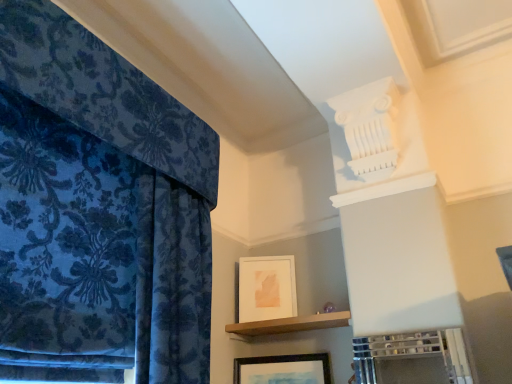
Question: Considering the relative sizes of velvet blue curtain at left and wooden framed picture at lower center, which is the 2th picture frame in back-to-front order, in the image provided, is velvet blue curtain at left taller than wooden framed picture at lower center, which is the 2th picture frame in back-to-front order,?

Choices:
 (A) no
 (B) yes

Answer: (B)

Question: Is velvet blue curtain at left bigger than wooden framed picture at lower center, positioned as the first picture frame in bottom-to-top order?

Choices:
 (A) no
 (B) yes

Answer: (B)

Question: Considering the relative positions of velvet blue curtain at left and wooden framed picture at lower center, the second picture frame in the top-to-bottom sequence, in the image provided, is velvet blue curtain at left to the right of wooden framed picture at lower center, the second picture frame in the top-to-bottom sequence, from the viewer's perspective?

Choices:
 (A) yes
 (B) no

Answer: (B)

Question: Is velvet blue curtain at left far away from wooden framed picture at lower center, positioned as the first picture frame in bottom-to-top order?

Choices:
 (A) yes
 (B) no

Answer: (B)

Question: Does velvet blue curtain at left touch wooden framed picture at lower center, which is counted as the first picture frame, starting from the front?

Choices:
 (A) yes
 (B) no

Answer: (B)

Question: In terms of width, does white matte picture frame at upper center, the 2th picture frame when ordered from front to back, look wider or thinner when compared to velvet blue curtain at left?

Choices:
 (A) wide
 (B) thin

Answer: (B)

Question: From a real-world perspective, is white matte picture frame at upper center, acting as the 1th picture frame starting from the top, positioned above or below velvet blue curtain at left?

Choices:
 (A) below
 (B) above

Answer: (A)

Question: From the image's perspective, relative to velvet blue curtain at left, is white matte picture frame at upper center, the 2th picture frame when ordered from front to back, above or below?

Choices:
 (A) above
 (B) below

Answer: (B)

Question: Considering the positions of point click(266, 286) and point click(78, 215), is point click(266, 286) closer or farther from the camera than point click(78, 215)?

Choices:
 (A) closer
 (B) farther

Answer: (B)

Question: Looking at the image, does brown wooden shelf at center seem bigger or smaller compared to wooden framed picture at lower center, the second picture frame in the top-to-bottom sequence?

Choices:
 (A) small
 (B) big

Answer: (B)

Question: Is point (241, 332) closer or farther from the camera than point (300, 367)?

Choices:
 (A) closer
 (B) farther

Answer: (B)

Question: From the image's perspective, is brown wooden shelf at center positioned above or below wooden framed picture at lower center, which is the 2th picture frame in back-to-front order?

Choices:
 (A) below
 (B) above

Answer: (B)

Question: From a real-world perspective, is brown wooden shelf at center positioned above or below wooden framed picture at lower center, which is the 2th picture frame in back-to-front order?

Choices:
 (A) below
 (B) above

Answer: (B)

Question: From a real-world perspective, relative to brown wooden shelf at center, is velvet blue curtain at left vertically above or below?

Choices:
 (A) below
 (B) above

Answer: (B)

Question: Considering the positions of velvet blue curtain at left and brown wooden shelf at center in the image, is velvet blue curtain at left taller or shorter than brown wooden shelf at center?

Choices:
 (A) short
 (B) tall

Answer: (B)